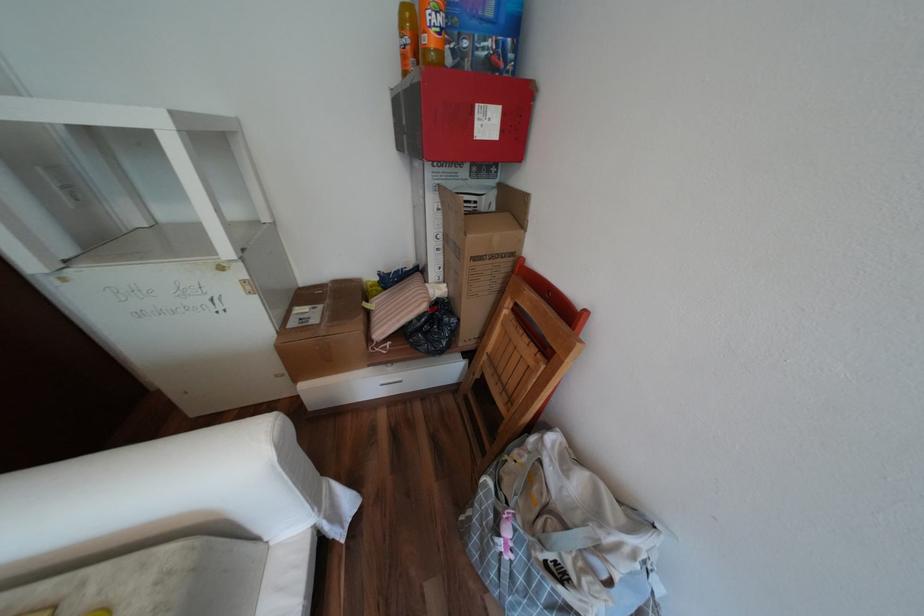
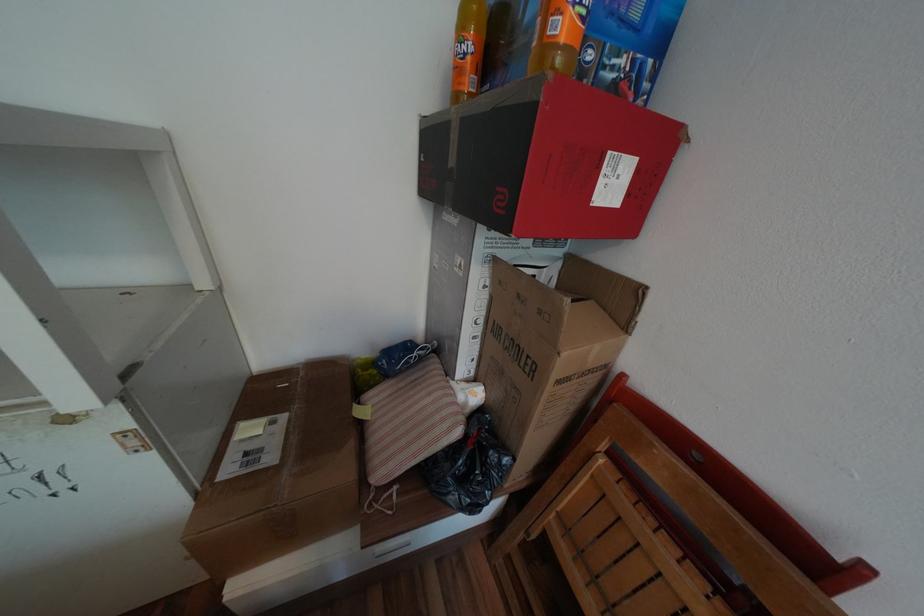
Question: Based on the continuous images, in which direction is the camera rotating? Reply with the corresponding letter.

Choices:
 (A) Left
 (B) Right
 (C) Up
 (D) Down

Answer: (B)